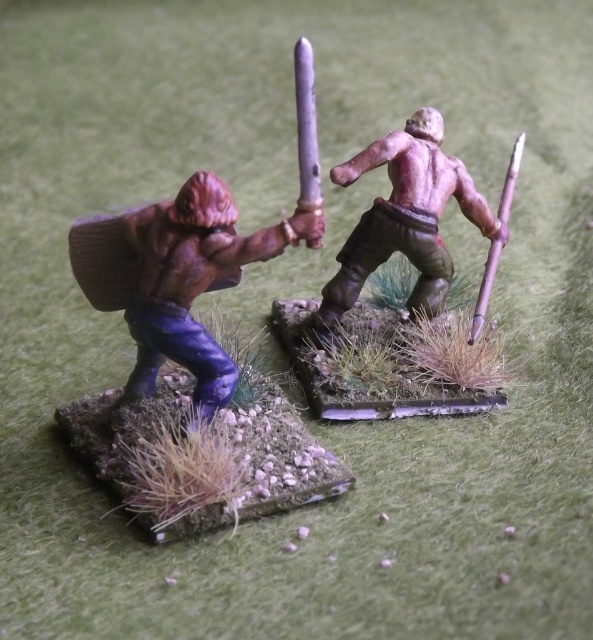
Where is `matte brown shield at left`? matte brown shield at left is located at coordinates (171, 280).

Is point (215, 269) closer to viewer compared to point (404, 221)?

Yes, it is.

Describe the element at coordinates (171, 280) in the screenshot. I see `matte brown shield at left` at that location.

Image resolution: width=593 pixels, height=640 pixels. What are the coordinates of `matte brown shield at left` in the screenshot? It's located at (171, 280).

Between smooth brown spear at center and shiny silver sword at center, which one has less height?

shiny silver sword at center

Who is more forward, (428, 182) or (302, 141)?

Positioned in front is point (302, 141).

You are a GUI agent. You are given a task and a screenshot of the screen. Output one action in this format:
    pyautogui.click(x=<x>, y=<y>)
    Task: Click on the smooth brown spear at center
    The width and height of the screenshot is (593, 640).
    Given the screenshot: What is the action you would take?
    pyautogui.click(x=406, y=218)

Which is above, smooth brown spear at center or shiny bronze spear at upper right?

smooth brown spear at center

Which is more to the right, smooth brown spear at center or shiny bronze spear at upper right?

From the viewer's perspective, shiny bronze spear at upper right appears more on the right side.

What are the coordinates of `smooth brown spear at center` in the screenshot? It's located at (406, 218).